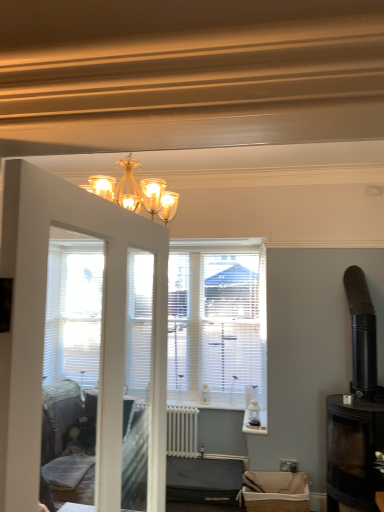
Question: Considering the positions of point (208, 470) and point (380, 429), is point (208, 470) closer or farther from the camera than point (380, 429)?

Choices:
 (A) farther
 (B) closer

Answer: (A)

Question: Is dark gray fabric sofa at lower center, the 1th furniture from the back, in front of or behind black glass fireplace at right in the image?

Choices:
 (A) front
 (B) behind

Answer: (B)

Question: Based on their relative distances, which object is nearer to the burlap basket at lower center, marked as the 2th furniture in a back-to-front arrangement?

Choices:
 (A) dark gray fabric sofa at lower center, the 1th furniture from the back
 (B) white painted radiator at center
 (C) gold metallic chandelier at upper center
 (D) black glass fireplace at right

Answer: (A)

Question: Which object is the farthest from the dark gray fabric sofa at lower center, which is the second furniture in front-to-back order?

Choices:
 (A) burlap basket at lower center, which ranks as the 2th furniture in left-to-right order
 (B) gold metallic chandelier at upper center
 (C) white painted radiator at center
 (D) black glass fireplace at right

Answer: (B)